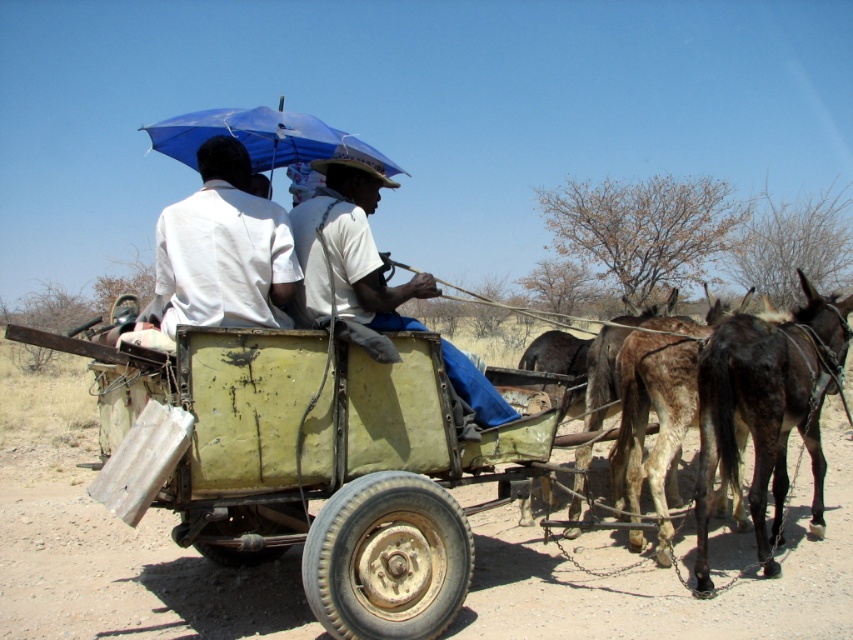
You are a traveler in this rural scene and need to identify the person wearing the white matte shirt at upper center. Which direction should you look relative to the white cotton shirt at center?

The white matte shirt at upper center is located to the left of the white cotton shirt at center, so you should look to the left of the white cotton shirt at center to find the person wearing the white matte shirt at upper center.